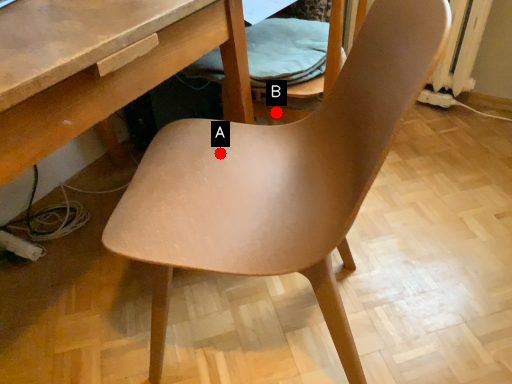
Question: Two points are circled on the image, labeled by A and B beside each circle. Which of the following is the farthest from the observer?

Choices:
 (A) A is further
 (B) B is further

Answer: (B)